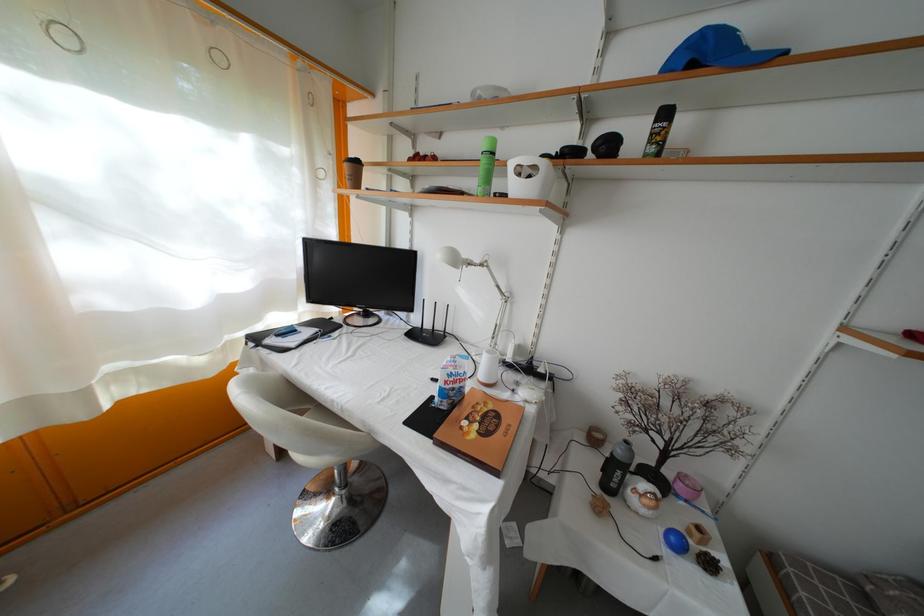
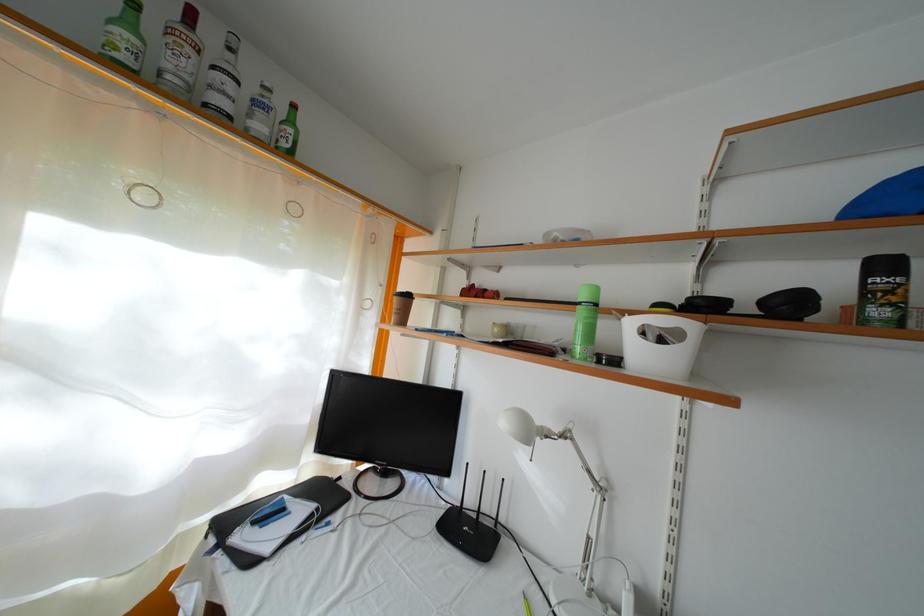
Where in the second image is the point corresponding to (x=504, y=293) from the first image?

(594, 477)